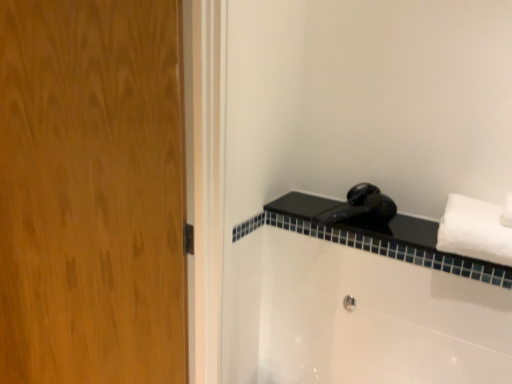
Question: Is black glossy hairdryer at upper right touching white fluffy towel at right?

Choices:
 (A) yes
 (B) no

Answer: (B)

Question: Considering the relative sizes of black glossy hairdryer at upper right and white fluffy towel at right in the image provided, is black glossy hairdryer at upper right wider than white fluffy towel at right?

Choices:
 (A) yes
 (B) no

Answer: (B)

Question: Is black glossy hairdryer at upper right bigger than white fluffy towel at right?

Choices:
 (A) yes
 (B) no

Answer: (B)

Question: Could you tell me if black glossy hairdryer at upper right is facing white fluffy towel at right?

Choices:
 (A) no
 (B) yes

Answer: (A)

Question: Does black glossy hairdryer at upper right appear on the left side of white fluffy towel at right?

Choices:
 (A) yes
 (B) no

Answer: (A)

Question: From the image's perspective, is black glossy hairdryer at upper right over white fluffy towel at right?

Choices:
 (A) no
 (B) yes

Answer: (A)

Question: Is black matte faucet at upper right looking in the opposite direction of wooden door at left?

Choices:
 (A) yes
 (B) no

Answer: (B)

Question: Is black matte faucet at upper right bigger than wooden door at left?

Choices:
 (A) yes
 (B) no

Answer: (B)

Question: Considering the relative sizes of black matte faucet at upper right and wooden door at left in the image provided, is black matte faucet at upper right wider than wooden door at left?

Choices:
 (A) yes
 (B) no

Answer: (A)

Question: From a real-world perspective, does black matte faucet at upper right sit lower than wooden door at left?

Choices:
 (A) no
 (B) yes

Answer: (A)

Question: Is black matte faucet at upper right in contact with wooden door at left?

Choices:
 (A) no
 (B) yes

Answer: (A)

Question: Is black matte faucet at upper right smaller than wooden door at left?

Choices:
 (A) yes
 (B) no

Answer: (A)

Question: Is wooden door at left next to white fluffy towel at right and touching it?

Choices:
 (A) no
 (B) yes

Answer: (A)